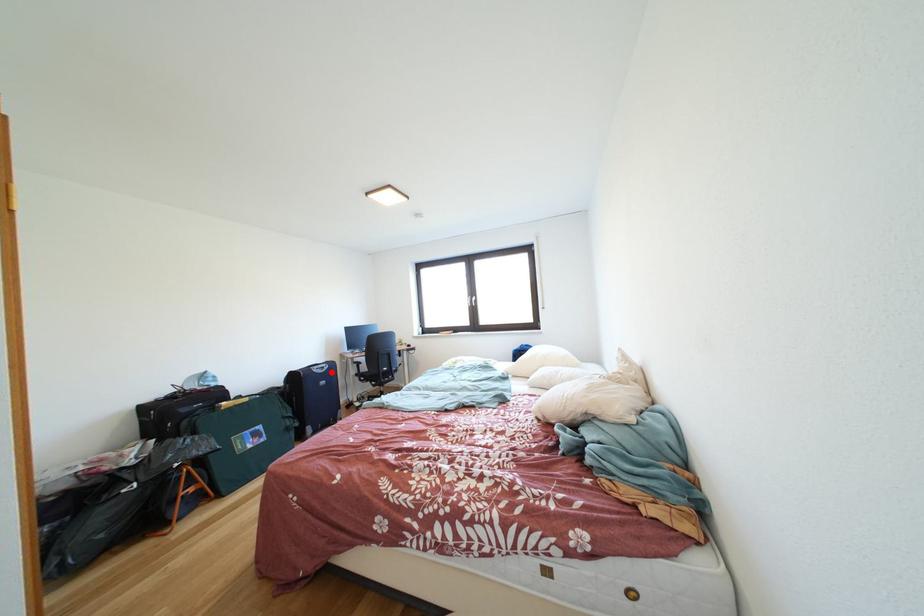
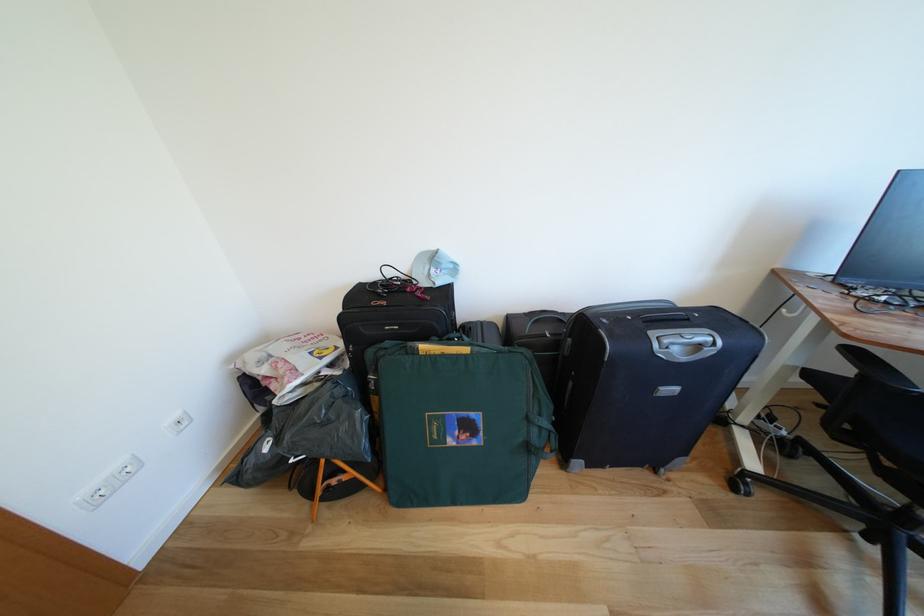
Where in the second image is the point corresponding to the highlighted location from the first image?

(707, 351)